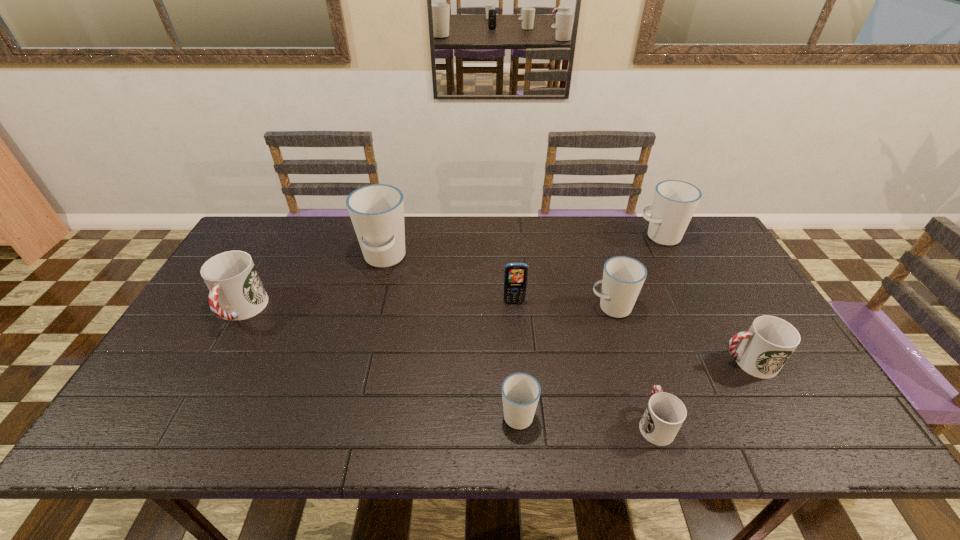
I want to click on free point located on the handle side of the second red cup from right to left, so click(622, 322).

What are the coordinates of `vacant region located 0.170m on the handle side of the second red cup from right to left` in the screenshot? It's located at (630, 345).

You are a GUI agent. You are given a task and a screenshot of the screen. Output one action in this format:
    pyautogui.click(x=<x>, y=<y>)
    Task: Click on the free spot located 0.260m on the handle side of the second red cup from right to left
    
    Given the screenshot: What is the action you would take?
    pyautogui.click(x=621, y=320)

Where is `object that is at the left edge`? object that is at the left edge is located at coordinates (236, 291).

The image size is (960, 540). What are the coordinates of `object located at the far right corner` in the screenshot? It's located at (675, 201).

What are the coordinates of `blank area at the far edge` in the screenshot? It's located at (335, 222).

In the image, there is a desktop. Identify the location of vacant space at the near edge. The width and height of the screenshot is (960, 540). (279, 436).

Image resolution: width=960 pixels, height=540 pixels. Find the location of `free space at the left edge of the desktop`. free space at the left edge of the desktop is located at coordinates (181, 362).

In order to click on vacant space at the right edge in this screenshot , I will do `click(701, 264)`.

At what (x,y) coordinates should I click in order to perform the action: click on free spot at the far left corner of the desktop. Please return your answer as a coordinate pair (x, y). The image size is (960, 540). Looking at the image, I should click on (276, 217).